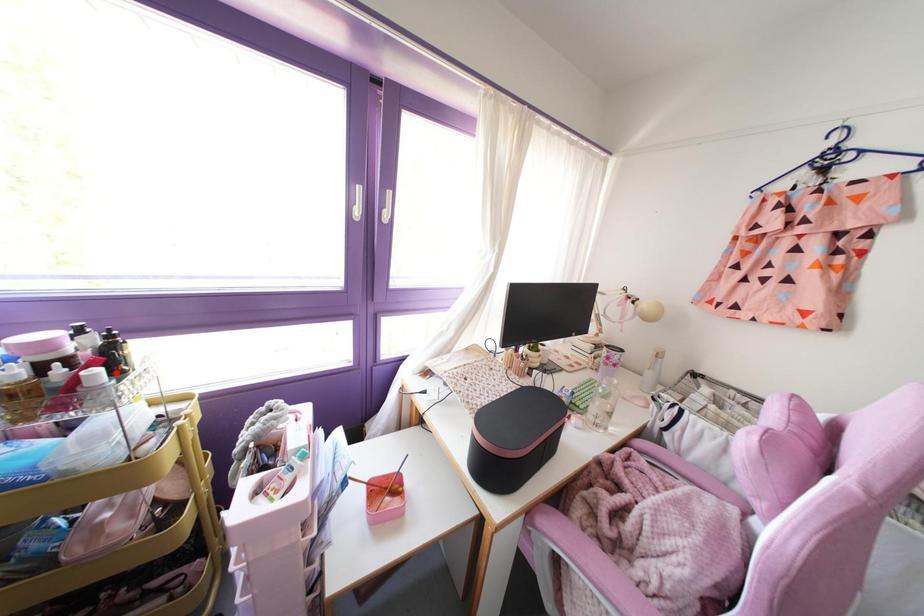
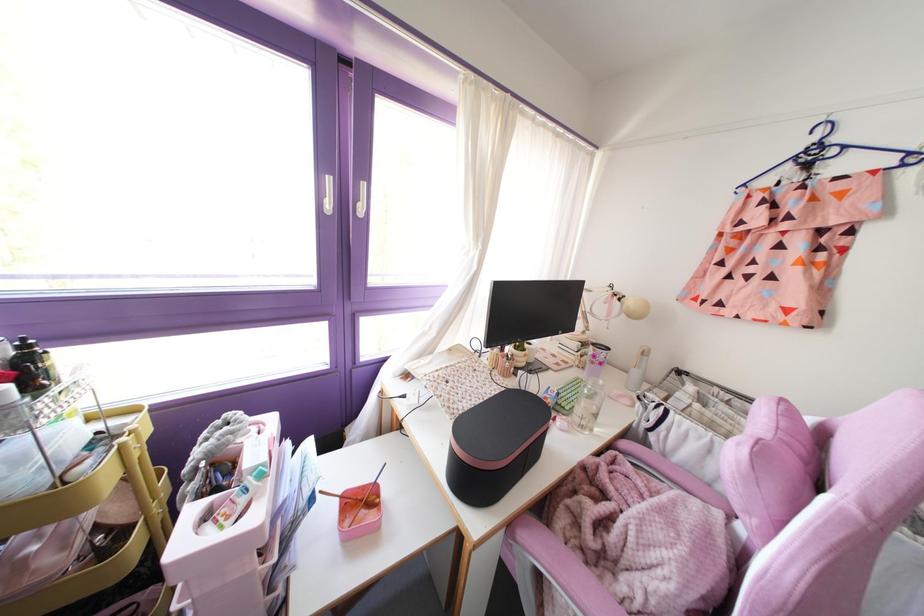
Find the pixel in the second image that matches the highlighted location in the first image.

(32, 389)